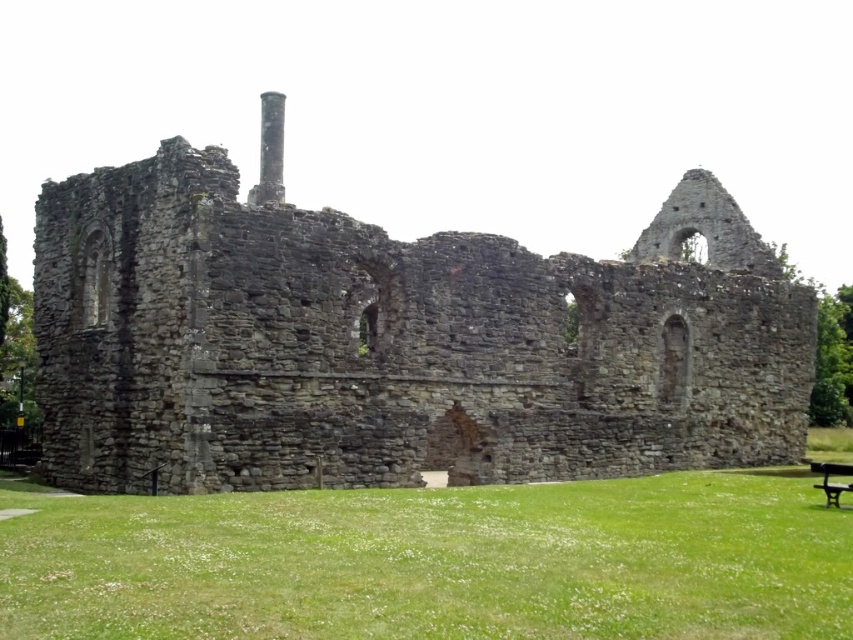
Question: Is rusty stone ruins at center below green grass at lower center?

Choices:
 (A) yes
 (B) no

Answer: (B)

Question: Which of the following is the farthest from the observer?

Choices:
 (A) rusty stone ruins at center
 (B) black wooden bench at lower right

Answer: (A)

Question: Which object is positioned farthest from the rusty stone ruins at center?

Choices:
 (A) green grass at lower center
 (B) black wooden bench at lower right

Answer: (B)

Question: Which object is closer to the camera taking this photo?

Choices:
 (A) green grass at lower center
 (B) black wooden bench at lower right

Answer: (A)

Question: Does rusty stone ruins at center have a smaller size compared to green grass at lower center?

Choices:
 (A) yes
 (B) no

Answer: (B)

Question: Is green grass at lower center to the left of black wooden bench at lower right from the viewer's perspective?

Choices:
 (A) no
 (B) yes

Answer: (B)